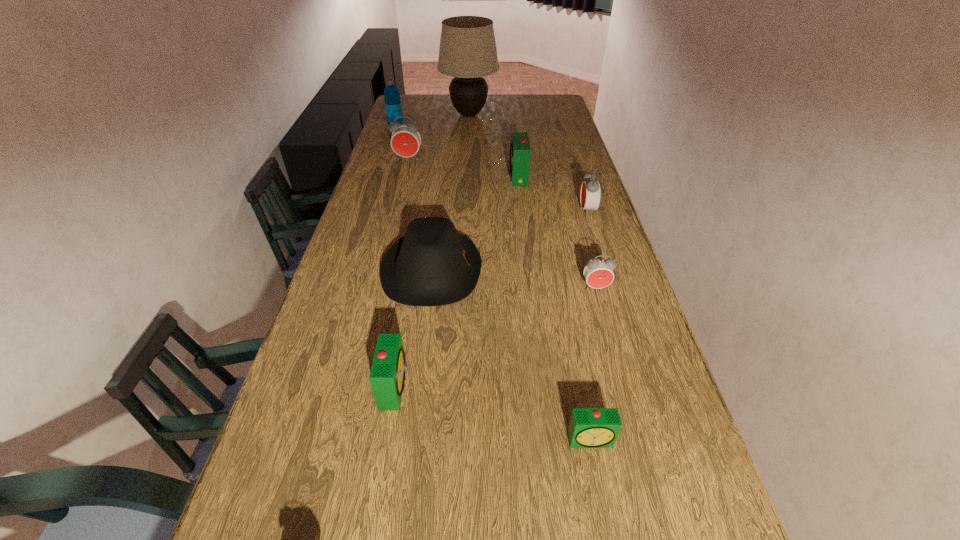
The image size is (960, 540). Identify the location of free space located on the face of the second farthest red alarm clock. (565, 211).

You are a GUI agent. You are given a task and a screenshot of the screen. Output one action in this format:
    pyautogui.click(x=<x>, y=<y>)
    Task: Click on the vacant space located 0.280m on the front-facing side of the farthest green alarm clock
    The image size is (960, 540).
    Given the screenshot: What is the action you would take?
    pyautogui.click(x=436, y=177)

You are a GUI agent. You are given a task and a screenshot of the screen. Output one action in this format:
    pyautogui.click(x=<x>, y=<y>)
    Task: Click on the free space located on the front-facing side of the farthest green alarm clock
    This screenshot has height=540, width=960.
    Given the screenshot: What is the action you would take?
    pyautogui.click(x=430, y=177)

At what (x,y) coordinates should I click in order to perform the action: click on vacant region located on the front-facing side of the farthest green alarm clock. Please return your answer as a coordinate pair (x, y). This screenshot has height=540, width=960. Looking at the image, I should click on (418, 177).

What are the coordinates of `vacant space located on the front-facing side of the fedora` in the screenshot? It's located at (548, 272).

At what (x,y) coordinates should I click in order to perform the action: click on vacant space located 0.160m on the face of the smallest red alarm clock. Please return your answer as a coordinate pair (x, y). The width and height of the screenshot is (960, 540). Looking at the image, I should click on (610, 339).

I want to click on free region located 0.060m on the front-facing side of the second biggest green alarm clock, so click(x=432, y=386).

The width and height of the screenshot is (960, 540). What are the coordinates of `free space located 0.110m on the front-facing side of the third object from right to left` in the screenshot? It's located at (604, 508).

Where is `object that is at the far edge`? The height and width of the screenshot is (540, 960). object that is at the far edge is located at coordinates (467, 51).

Where is `thermos bottle that is positioned at the left edge`? This screenshot has height=540, width=960. thermos bottle that is positioned at the left edge is located at coordinates (392, 98).